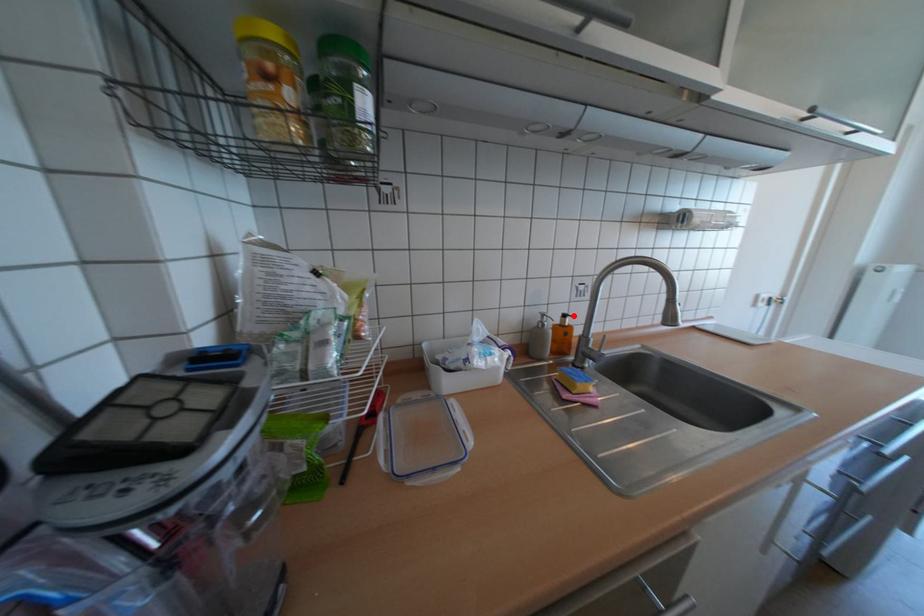
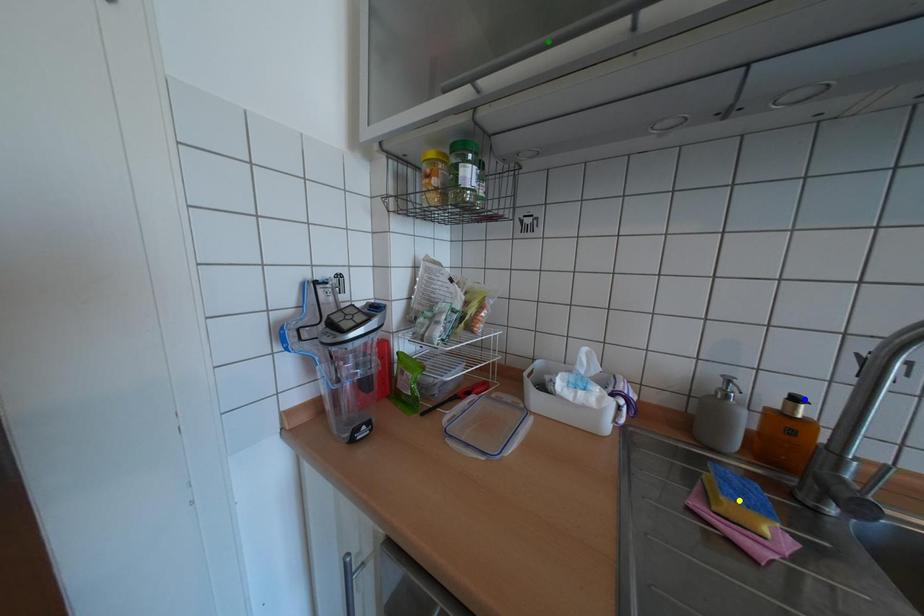
Question: I am providing you with two images of the same scene from different viewpoints. A red point is marked on the first image. You are given multiple points on the second image. Which point in image 2 is actually the same real-world point as the red point in image 1?

Choices:
 (A) blue point
 (B) green point
 (C) yellow point

Answer: (A)